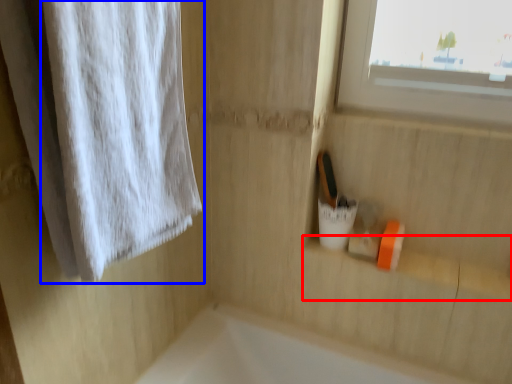
Question: Which of the following is the farthest to the observer, window sill (highlighted by a red box) or curtain (highlighted by a blue box)?

Choices:
 (A) window sill
 (B) curtain

Answer: (A)